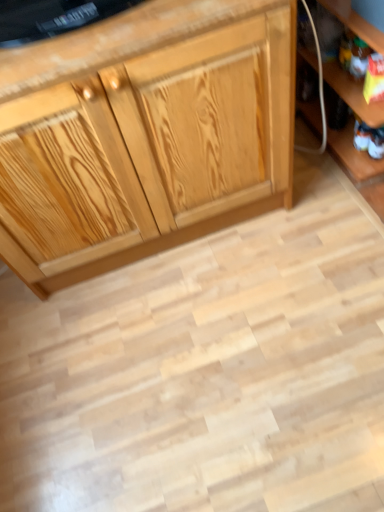
Question: Should I look upward or downward to see natural wood cabinet at center?

Choices:
 (A) down
 (B) up

Answer: (B)

Question: Does white fabric toy at lower right contain natural wood cabinet at center?

Choices:
 (A) no
 (B) yes

Answer: (A)

Question: Considering the relative sizes of white fabric toy at lower right and natural wood cabinet at center in the image provided, is white fabric toy at lower right shorter than natural wood cabinet at center?

Choices:
 (A) no
 (B) yes

Answer: (B)

Question: Does white fabric toy at lower right have a greater width compared to natural wood cabinet at center?

Choices:
 (A) no
 (B) yes

Answer: (A)

Question: Is white fabric toy at lower right further to the viewer compared to natural wood cabinet at center?

Choices:
 (A) yes
 (B) no

Answer: (A)

Question: From a real-world perspective, does white fabric toy at lower right sit lower than natural wood cabinet at center?

Choices:
 (A) yes
 (B) no

Answer: (A)

Question: Are white fabric toy at lower right and natural wood cabinet at center making contact?

Choices:
 (A) no
 (B) yes

Answer: (A)

Question: Can you confirm if white fabric toy at lower right is smaller than wooden shelf at lower right?

Choices:
 (A) yes
 (B) no

Answer: (A)

Question: Does white fabric toy at lower right have a lesser height compared to wooden shelf at lower right?

Choices:
 (A) no
 (B) yes

Answer: (B)

Question: From the image's perspective, is white fabric toy at lower right below wooden shelf at lower right?

Choices:
 (A) no
 (B) yes

Answer: (B)

Question: Is white fabric toy at lower right touching wooden shelf at lower right?

Choices:
 (A) no
 (B) yes

Answer: (A)

Question: Considering the relative sizes of white fabric toy at lower right and wooden shelf at lower right in the image provided, is white fabric toy at lower right wider than wooden shelf at lower right?

Choices:
 (A) yes
 (B) no

Answer: (B)

Question: Is white fabric toy at lower right at the right side of wooden shelf at lower right?

Choices:
 (A) yes
 (B) no

Answer: (B)

Question: Does wooden shelf at lower right lie behind white fabric toy at lower right?

Choices:
 (A) yes
 (B) no

Answer: (B)